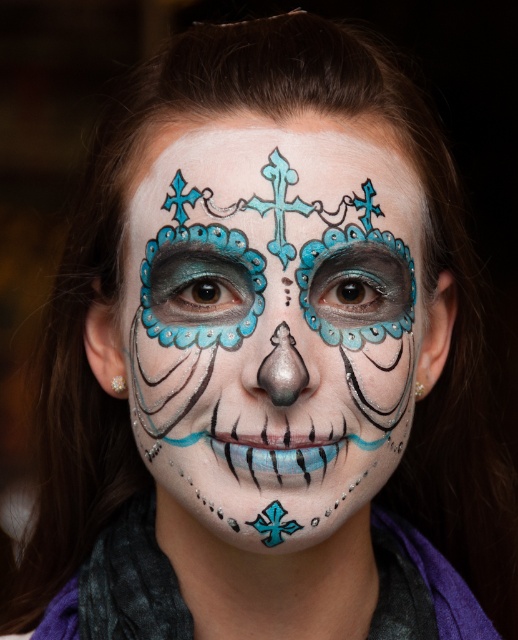
You are an artist preparing to add a new design to the existing face paint on the person. You have a small brush and want to paint a new pattern between the matte blue face paint at center and the blue glossy cross at lower center. Is there enough space to do this?

The matte blue face paint at center is above the blue glossy cross at lower center, so there is space between them to paint a new pattern.

You are an artist observing the person with the intricate Day of the Dead face paint. You notice the matte blue face paint at center. Where exactly is this blue face paint positioned on their face?

The matte blue face paint at center is located at point coordinates of approximately 0.505 on the x and 0.527 on the y axis, which places it centrally on the face.